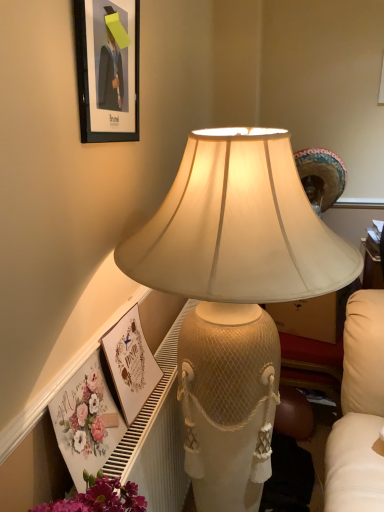
Question: Is the depth of matte cream lampshade at center less than that of matte black frame at upper left, which is the 1th picture frame in top-to-bottom order?

Choices:
 (A) yes
 (B) no

Answer: (A)

Question: Are matte cream lampshade at center and matte black frame at upper left, which is the 1th picture frame in top-to-bottom order, making contact?

Choices:
 (A) no
 (B) yes

Answer: (A)

Question: Is matte cream lampshade at center looking in the opposite direction of matte black frame at upper left, acting as the second picture frame starting from the bottom?

Choices:
 (A) no
 (B) yes

Answer: (A)

Question: Considering the relative sizes of matte cream lampshade at center and matte black frame at upper left, acting as the second picture frame starting from the bottom, in the image provided, is matte cream lampshade at center wider than matte black frame at upper left, acting as the second picture frame starting from the bottom,?

Choices:
 (A) yes
 (B) no

Answer: (A)

Question: Would you say matte black frame at upper left, acting as the second picture frame starting from the bottom, is part of matte cream lampshade at center's contents?

Choices:
 (A) yes
 (B) no

Answer: (B)

Question: Can you confirm if matte cream lampshade at center is thinner than matte black frame at upper left, acting as the second picture frame starting from the bottom?

Choices:
 (A) yes
 (B) no

Answer: (B)

Question: Considering the relative sizes of matte black frame at upper left, acting as the second picture frame starting from the bottom, and matte white picture frame at lower center, the 1th picture frame positioned from the bottom, in the image provided, is matte black frame at upper left, acting as the second picture frame starting from the bottom, smaller than matte white picture frame at lower center, the 1th picture frame positioned from the bottom,?

Choices:
 (A) no
 (B) yes

Answer: (B)

Question: Is matte black frame at upper left, which is the 1th picture frame in top-to-bottom order, oriented towards matte white picture frame at lower center, the second picture frame positioned from the top?

Choices:
 (A) no
 (B) yes

Answer: (A)

Question: Would you say matte black frame at upper left, which is the 1th picture frame in top-to-bottom order, is a long distance from matte white picture frame at lower center, the 1th picture frame positioned from the bottom?

Choices:
 (A) no
 (B) yes

Answer: (A)

Question: Can you confirm if matte black frame at upper left, acting as the second picture frame starting from the bottom, is bigger than matte white picture frame at lower center, the second picture frame positioned from the top?

Choices:
 (A) yes
 (B) no

Answer: (B)

Question: From the image's perspective, does matte black frame at upper left, which is the 1th picture frame in top-to-bottom order, appear higher than matte white picture frame at lower center, the 1th picture frame positioned from the bottom?

Choices:
 (A) yes
 (B) no

Answer: (A)

Question: Is matte black frame at upper left, which is the 1th picture frame in top-to-bottom order, shorter than matte white picture frame at lower center, the 1th picture frame positioned from the bottom?

Choices:
 (A) no
 (B) yes

Answer: (A)

Question: Is matte white picture frame at lower center, the 1th picture frame positioned from the bottom, wider than matte black frame at upper left, which is the 1th picture frame in top-to-bottom order?

Choices:
 (A) yes
 (B) no

Answer: (A)